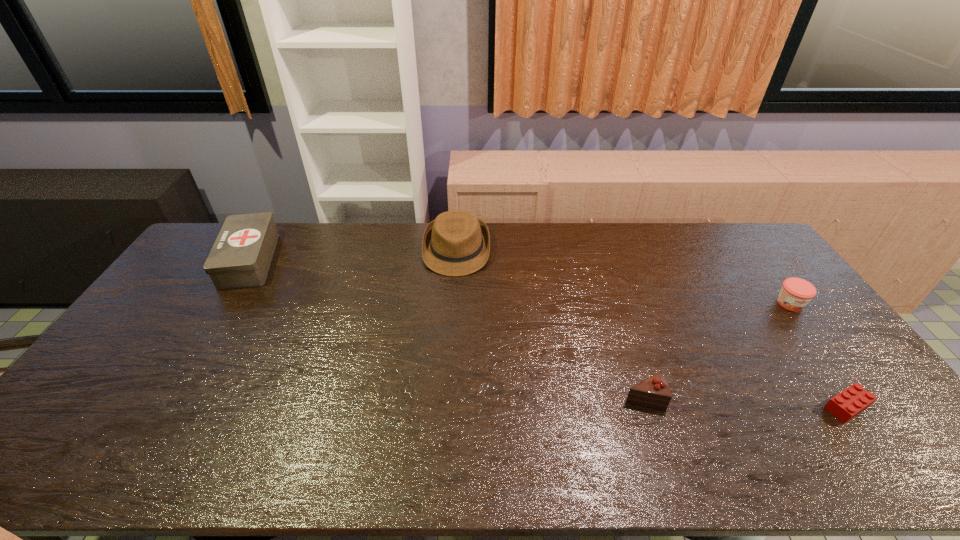
Locate an element on the screen. Image resolution: width=960 pixels, height=540 pixels. the second closest object to the fourth object from right to left is located at coordinates (654, 392).

You are a GUI agent. You are given a task and a screenshot of the screen. Output one action in this format:
    pyautogui.click(x=<x>, y=<y>)
    Task: Click on the third closest object relative to the fedora
    This screenshot has width=960, height=540.
    Given the screenshot: What is the action you would take?
    pyautogui.click(x=795, y=294)